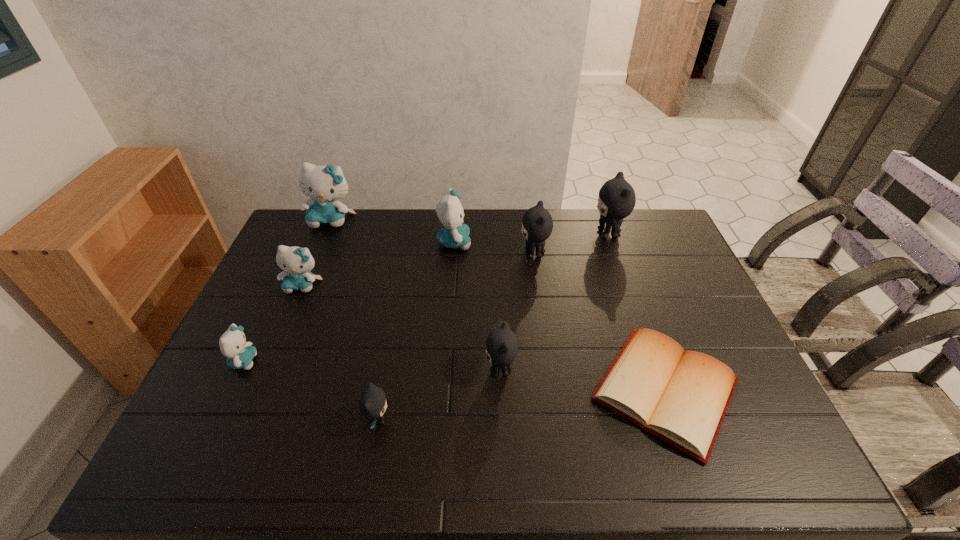
Identify the location of the sixth closest object to the biggest blue kitten. (x=372, y=404).

Locate an element on the screen. This screenshot has height=540, width=960. object that is the sixth closest to the biggest blue kitten is located at coordinates 372,404.

Identify which kitten is the eighth closest to the red Bible. Please provide its 2D coordinates. Your answer should be formatted as a tuple, i.e. [(x, y)], where the tuple contains the x and y coordinates of a point satisfying the conditions above.

[(323, 184)]

Identify the location of kitten that stands as the closest to the Bible. (501, 345).

This screenshot has height=540, width=960. I want to click on blue kitten that is the second closest to the Bible, so click(297, 263).

Locate an element on the screen. blue kitten object that ranks as the fourth closest to the third smallest gray kitten is located at coordinates (233, 345).

Locate which gray kitten is the closest to the fourth object from left to right. Please provide its 2D coordinates. Your answer should be formatted as a tuple, i.e. [(x, y)], where the tuple contains the x and y coordinates of a point satisfying the conditions above.

[(501, 345)]

Locate an element on the screen. gray kitten that can be found as the second closest to the rightmost blue kitten is located at coordinates (501, 345).

Identify the location of free space that satisfies the following two spatial constraints: 1. on the front-facing side of the red Bible; 2. on the left side of the seventh object from left to right. (553, 389).

Find the location of `free space that satisfies the following two spatial constraints: 1. on the front-facing side of the third smallest gray kitten; 2. on the back side of the Bible`. free space that satisfies the following two spatial constraints: 1. on the front-facing side of the third smallest gray kitten; 2. on the back side of the Bible is located at coordinates (553, 389).